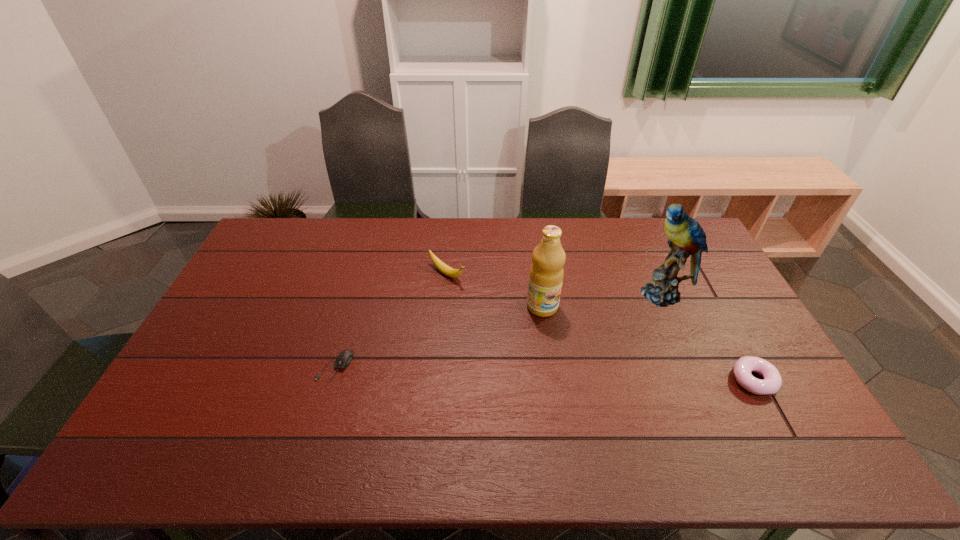
You are a GUI agent. You are given a task and a screenshot of the screen. Output one action in this format:
    pyautogui.click(x=<x>, y=<y>)
    Task: Click on the vacant space on the desktop that is between the mouse and the doughnut and is positioned on the face of the parrot
    The width and height of the screenshot is (960, 540).
    Given the screenshot: What is the action you would take?
    pyautogui.click(x=563, y=374)

Identify the location of vacant spot on the desktop that is between the shortest object and the doughnut and is positioned at the stem of the fourth object from right to left. (598, 375).

Where is `free space on the desktop that is between the leftmost object and the second shortest object and is positioned on the label of the second tallest object`? free space on the desktop that is between the leftmost object and the second shortest object and is positioned on the label of the second tallest object is located at coordinates (595, 375).